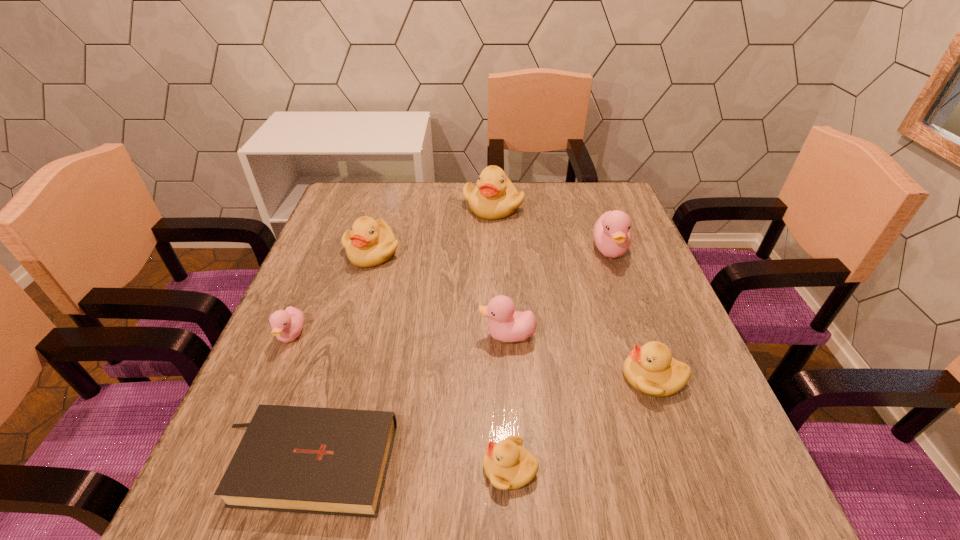
The image size is (960, 540). In order to click on vacant area situated at the face of the rightmost yellow duckling in this screenshot , I will do `click(446, 377)`.

Locate an element on the screen. vacant space located at the face of the rightmost yellow duckling is located at coordinates (571, 377).

I want to click on vacant region located at the face of the rightmost yellow duckling, so click(437, 377).

The width and height of the screenshot is (960, 540). Find the location of `vacant point located on the front-facing side of the leftmost pink duckling`. vacant point located on the front-facing side of the leftmost pink duckling is located at coordinates click(252, 428).

The height and width of the screenshot is (540, 960). I want to click on vacant space situated 0.300m at the face of the nearest duckling, so click(299, 468).

Identify the location of free space located at the face of the nearest duckling. This screenshot has width=960, height=540. (237, 468).

Where is `blank area located 0.380m at the face of the nearest duckling`? The height and width of the screenshot is (540, 960). blank area located 0.380m at the face of the nearest duckling is located at coordinates (250, 468).

Image resolution: width=960 pixels, height=540 pixels. I want to click on free spot located on the back of the Bible, so click(x=344, y=334).

Find the location of a particular element. object that is at the far edge is located at coordinates (x=495, y=197).

Locate an element on the screen. The height and width of the screenshot is (540, 960). duckling at the near edge is located at coordinates (508, 465).